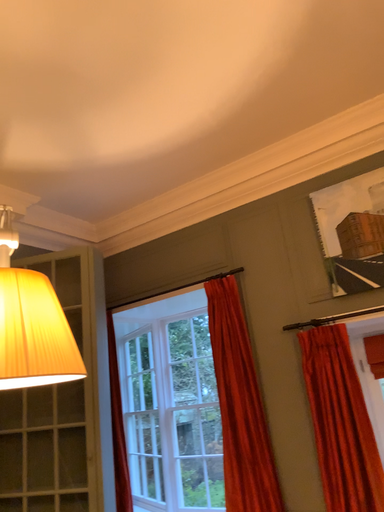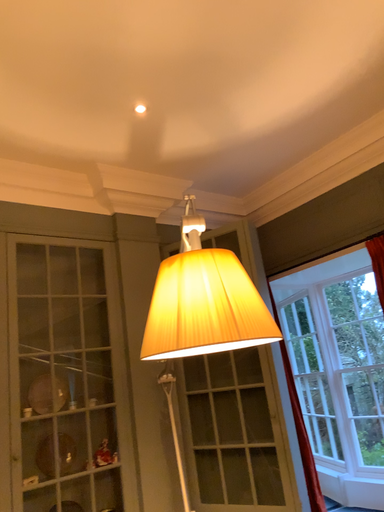
Question: Which way did the camera rotate in the video?

Choices:
 (A) rotated right
 (B) rotated left

Answer: (B)